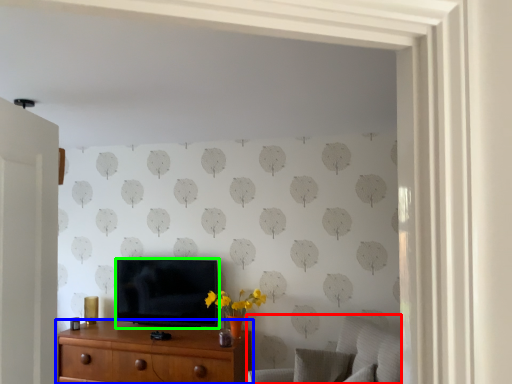
Question: Which object is positioned farthest from swivel chair (highlighted by a red box)? Select from chest of drawers (highlighted by a blue box) and television (highlighted by a green box).

Choices:
 (A) chest of drawers
 (B) television

Answer: (B)